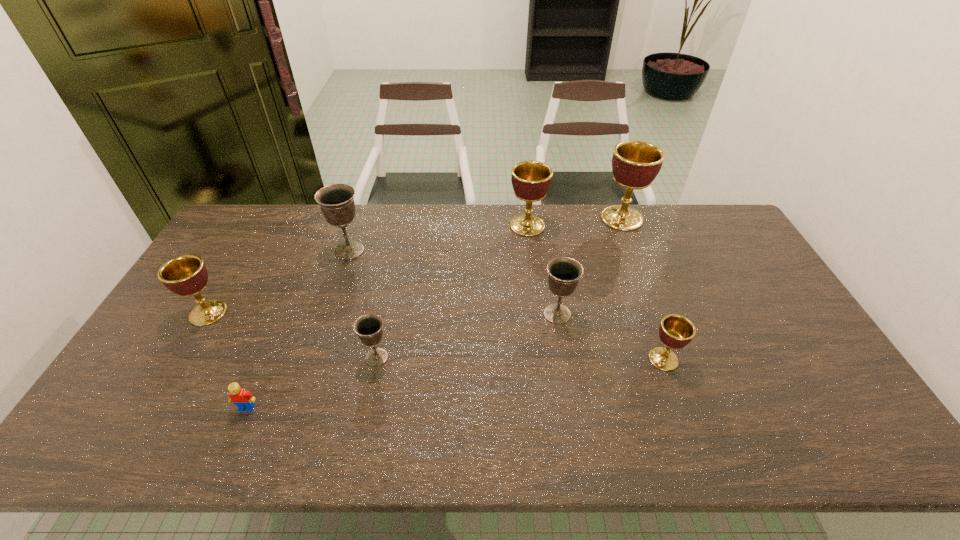
Locate an element on the screen. This screenshot has width=960, height=540. vacant space located on the right of the nearest golden chalice is located at coordinates (810, 359).

Locate an element on the screen. This screenshot has height=540, width=960. vacant position located 0.060m on the face of the nearest object is located at coordinates (235, 435).

Find the location of `object that is at the left edge`. object that is at the left edge is located at coordinates (186, 276).

At what (x,y) coordinates should I click in order to perform the action: click on vacant region at the far edge of the desktop. Please return your answer as a coordinate pair (x, y). Looking at the image, I should click on (353, 225).

Find the location of `vacant area at the near edge of the desktop`. vacant area at the near edge of the desktop is located at coordinates (725, 441).

The height and width of the screenshot is (540, 960). I want to click on free region at the right edge of the desktop, so click(737, 266).

Find the location of a particular element. The width and height of the screenshot is (960, 540). blank area at the far left corner is located at coordinates (225, 242).

Locate an element on the screen. vacant space in between the leftmost chalice and the nearest golden chalice is located at coordinates 436,336.

Identify the location of unoccupied area between the second chalice from left to right and the second golden chalice from left to right. This screenshot has width=960, height=540. (439, 238).

At what (x,y) coordinates should I click in order to perform the action: click on empty space that is in between the second nearest bronze chalice and the Lego. Please return your answer as a coordinate pair (x, y). Image resolution: width=960 pixels, height=540 pixels. Looking at the image, I should click on (402, 361).